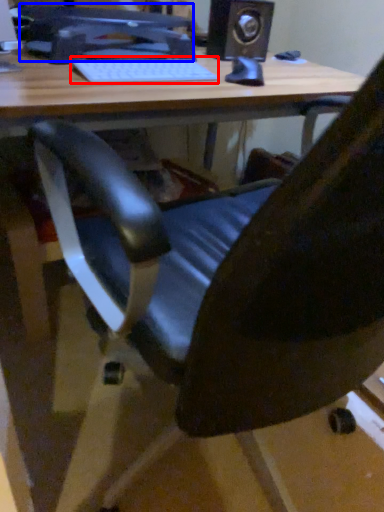
Question: Which point is further to the camera, laptop keyboard (highlighted by a red box) or computer monitor (highlighted by a blue box)?

Choices:
 (A) laptop keyboard
 (B) computer monitor

Answer: (B)